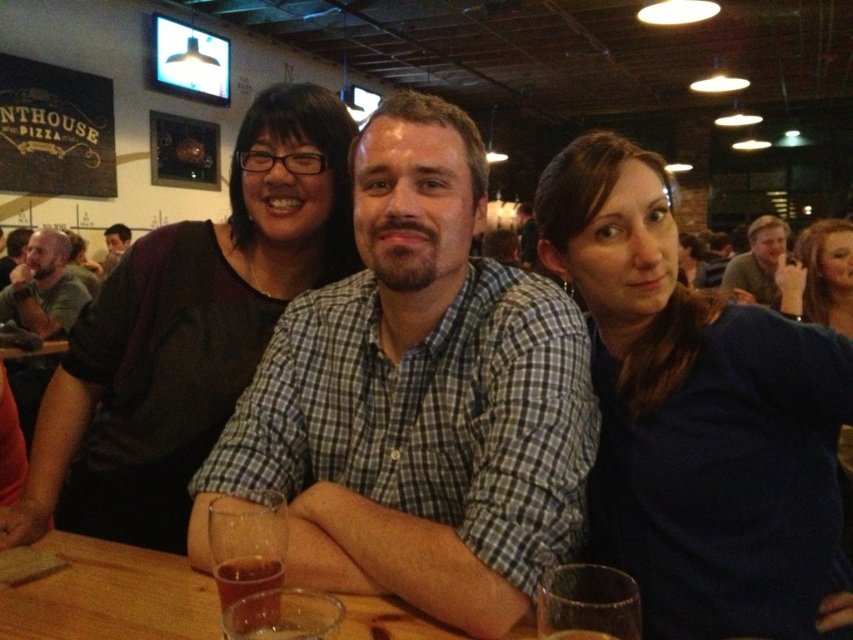
You are standing at the origin of the coordinate system in this image. You want to move towards the point at (254, 621). Will you pass by the point at (839, 250) before reaching your destination?

No, because point (839, 250) is behind point (254, 621), so you will reach (254, 621) first without passing by the other point.

You are a waiter at the pizzeria and need to place a drink on the table. The customer wearing the matte blue shirt at center wants it to their left side. Where should you place the drink relative to the translucent glass at table center?

You should place the drink to the left of the translucent glass at table center because the matte blue shirt at center is to the right of the translucent glass at table center, so placing it to the left of the glass would be on the customer s left side.